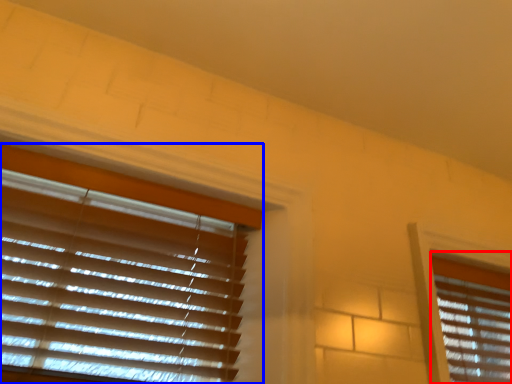
Question: Which of the following is the farthest to the observer, window blind (highlighted by a red box) or window blind (highlighted by a blue box)?

Choices:
 (A) window blind
 (B) window blind

Answer: (A)